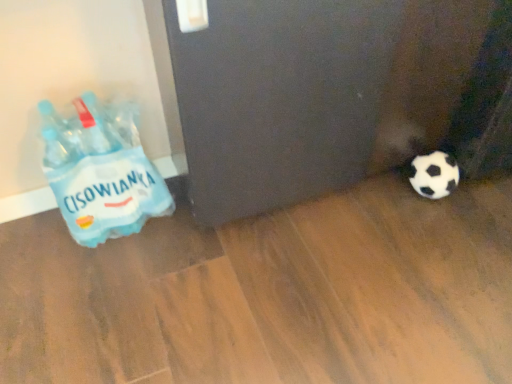
Identify the location of vacant point to the right of blue plastic bottle at left. This screenshot has height=384, width=512. (197, 242).